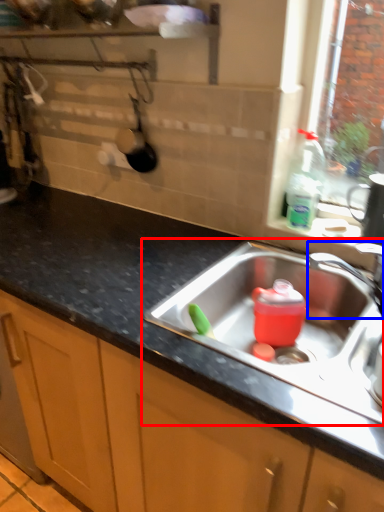
Question: Among these objects, which one is farthest to the camera, sink (highlighted by a red box) or tap (highlighted by a blue box)?

Choices:
 (A) sink
 (B) tap

Answer: (B)